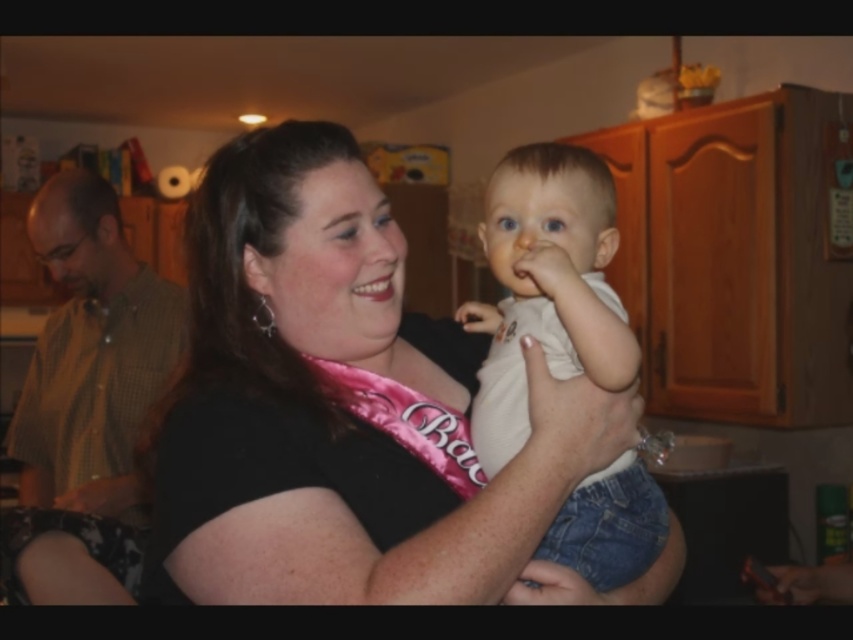
You are a photographer setting up for a wedding photo shoot. You need to ensure that the black satin sash at center and the green checkered shirt at left are both visible in the frame. Based on their sizes, which object should you focus on first to ensure both are in the shot?

The black satin sash at center occupies less space than the green checkered shirt at left, so you should focus on positioning the black satin sash at center first to ensure it is visible alongside the larger green checkered shirt at left.